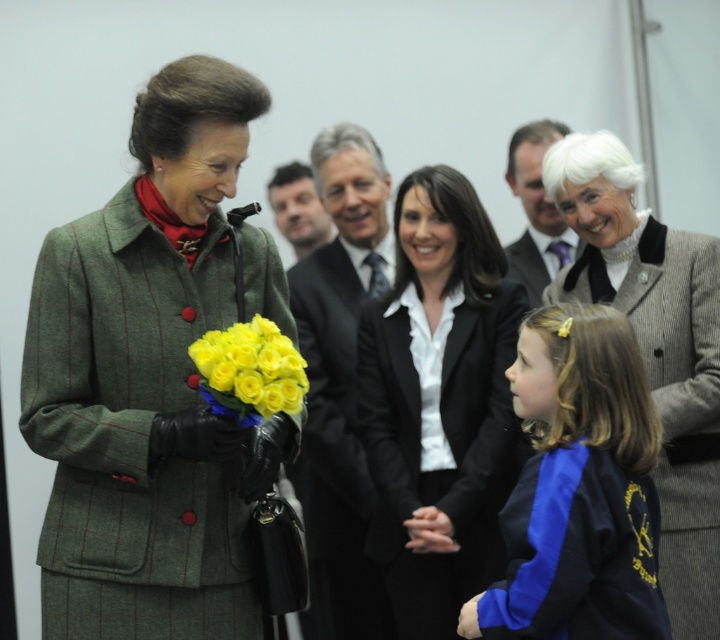
Question: Is green woolen coat at left to the left of dark gray wool business suit at upper center from the viewer's perspective?

Choices:
 (A) no
 (B) yes

Answer: (B)

Question: Considering the relative positions of green woolen coat at left and black satin blazer at center in the image provided, where is green woolen coat at left located with respect to black satin blazer at center?

Choices:
 (A) above
 (B) below

Answer: (A)

Question: Which object is positioned closest to the smooth brown leather jacket at center?

Choices:
 (A) yellow matte roses at center
 (B) dark gray wool business suit at upper center

Answer: (B)

Question: Which object is positioned closest to the gray woolen blazer at upper right?

Choices:
 (A) black suit at center
 (B) yellow matte roses at center
 (C) blue fabric jacket at lower right
 (D) black satin blazer at center

Answer: (D)

Question: Can you confirm if gray woolen blazer at upper right is positioned below smooth brown leather jacket at center?

Choices:
 (A) yes
 (B) no

Answer: (A)

Question: Which of the following is the farthest from the observer?

Choices:
 (A) (495, 300)
 (B) (526, 285)
 (C) (366, 145)
 (D) (166, 248)

Answer: (B)